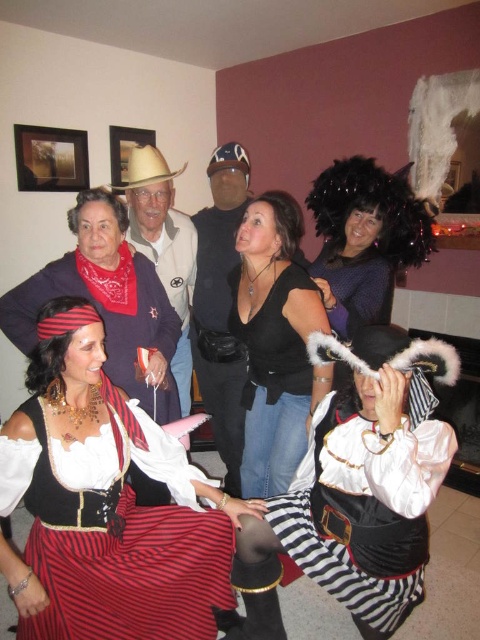
You are a costume designer preparing for a play and need to decide whether the black leather jacket at center can be stored in the wooden frame at upper left. Based on their sizes, will it fit?

The black leather jacket at center is larger in size than the wooden frame at upper left, so it cannot fit inside the wooden frame at upper left.

You are a photographer setting up for a group photo. You notice the light brown felt cowboy hat at center and the brown leather cowboy hat at upper center. Which hat is shorter in height?

The light brown felt cowboy hat at center is shorter in height compared to the brown leather cowboy hat at upper center.

You are a photographer setting up for a group photo. You need to ensure that the striped cotton skirt at lower left and the velvet pirate costume at center are both visible in the frame. Based on their positions, which one should you focus on first to ensure both are in focus?

The striped cotton skirt at lower left is in front of the velvet pirate costume at center, so you should focus on the velvet pirate costume at center first to ensure both are in focus.